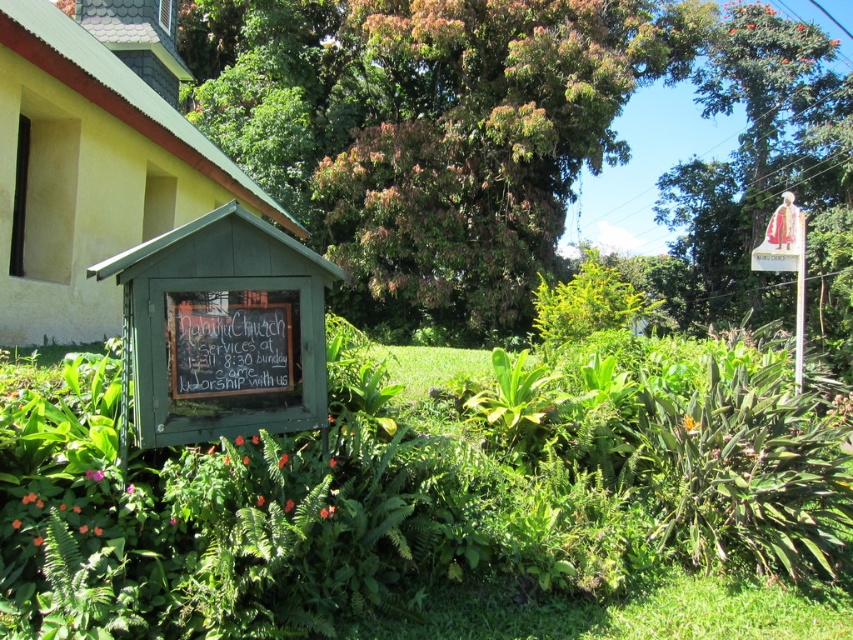
You are standing in front of the church notice board and want to walk towards the point labeled as point (x=190, y=634). Will you pass by the point labeled as point (x=772, y=212) on your way?

Point (x=190, y=634) is in front of point (x=772, y=212), so you will not pass by point (x=772, y=212) on your way to point (x=190, y=634) since it is behind your path.

You are a visitor at the Nanu<u Church and want to read both the green matte signboard at lower left and the wooden sign at upper right. Which sign will you need to look down to see?

The green matte signboard at lower left has a lesser height compared to wooden sign at upper right, so you will need to look down to see the green matte signboard at lower left.